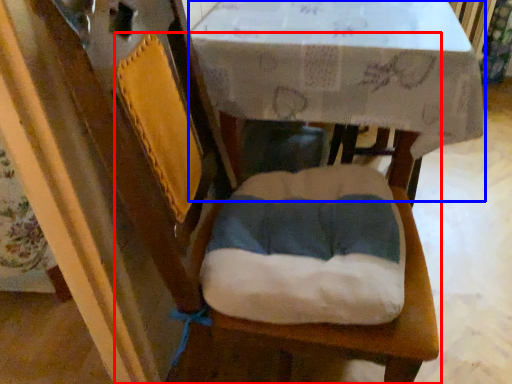
Question: Which point is further to the camera, chair (highlighted by a red box) or round table (highlighted by a blue box)?

Choices:
 (A) chair
 (B) round table

Answer: (A)